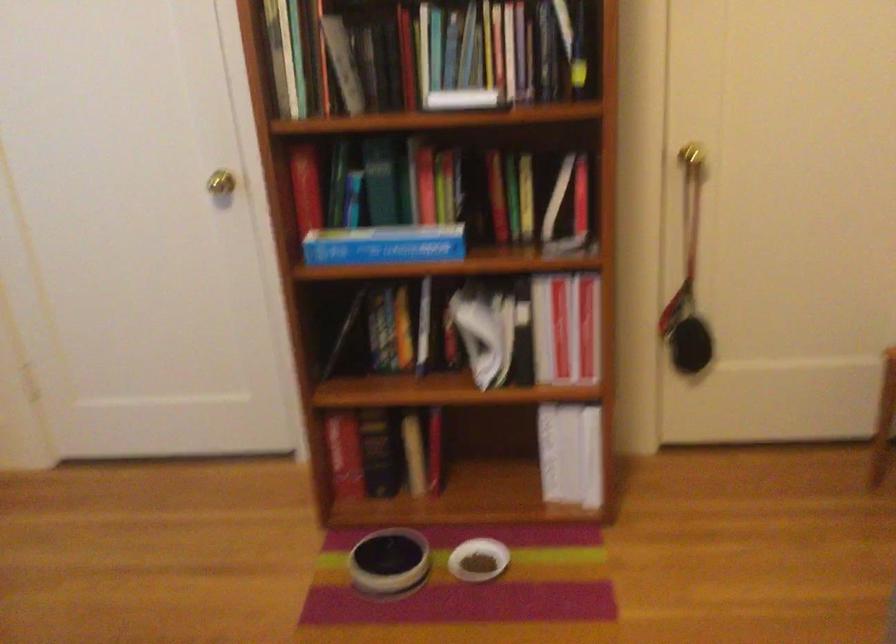
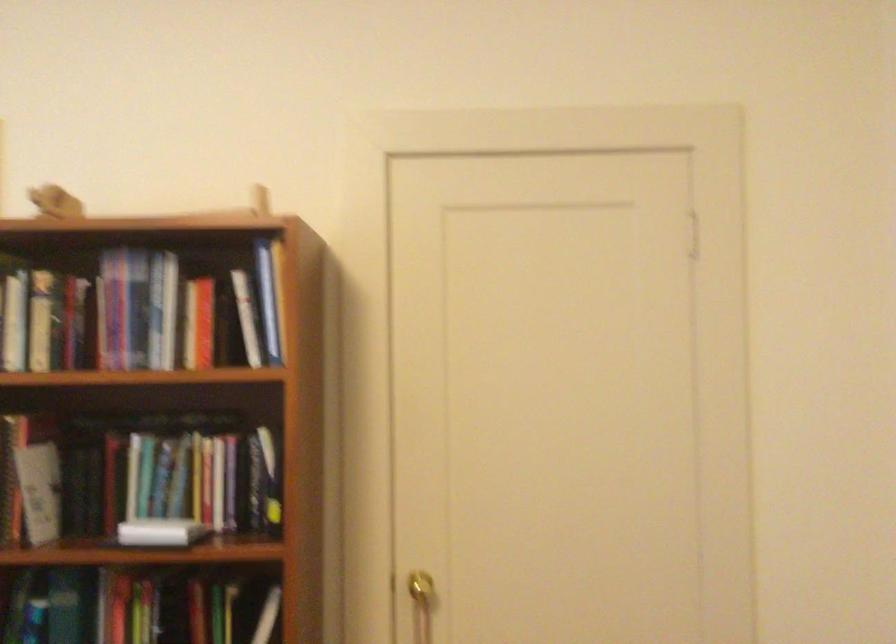
Question: In a continuous first-person perspective shot, in which direction is the camera moving?

Choices:
 (A) Left
 (B) Right
 (C) Forward
 (D) Backward

Answer: (B)